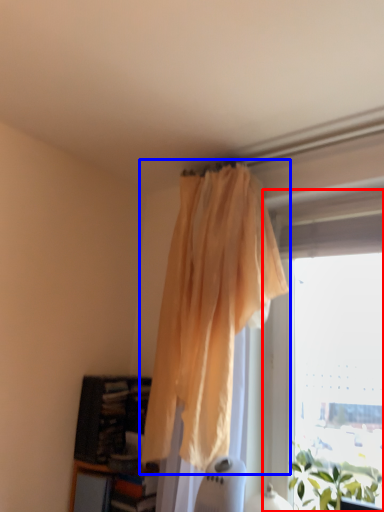
Question: Which of the following is the closest to the observer, window (highlighted by a red box) or curtain (highlighted by a blue box)?

Choices:
 (A) window
 (B) curtain

Answer: (B)